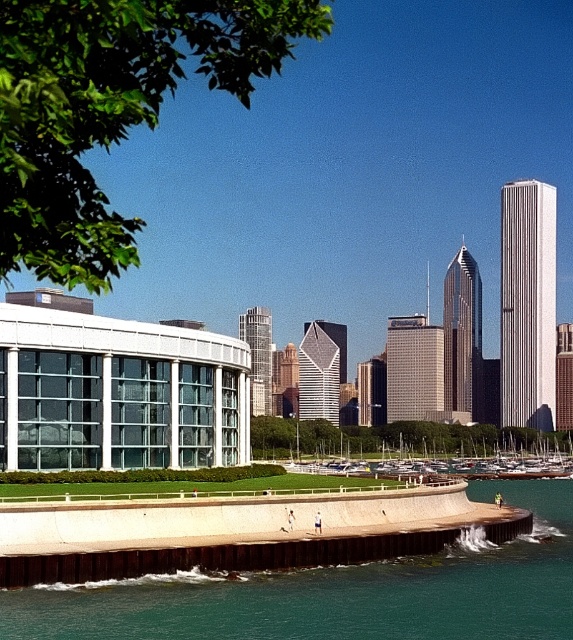
Question: Which point is closer to the camera?

Choices:
 (A) white wooden boats at center
 (B) teal concrete wall at lower center

Answer: (B)

Question: Is teal concrete wall at lower center bigger than white wooden boats at center?

Choices:
 (A) yes
 (B) no

Answer: (B)

Question: Which point is farther to the camera?

Choices:
 (A) (327, 445)
 (B) (89, 609)

Answer: (A)

Question: Is teal concrete wall at lower center to the right of white wooden boats at center from the viewer's perspective?

Choices:
 (A) no
 (B) yes

Answer: (A)

Question: Can you confirm if teal concrete wall at lower center is positioned to the left of white wooden boats at center?

Choices:
 (A) yes
 (B) no

Answer: (A)

Question: Which point appears farthest from the camera in this image?

Choices:
 (A) (368, 445)
 (B) (111, 620)

Answer: (A)